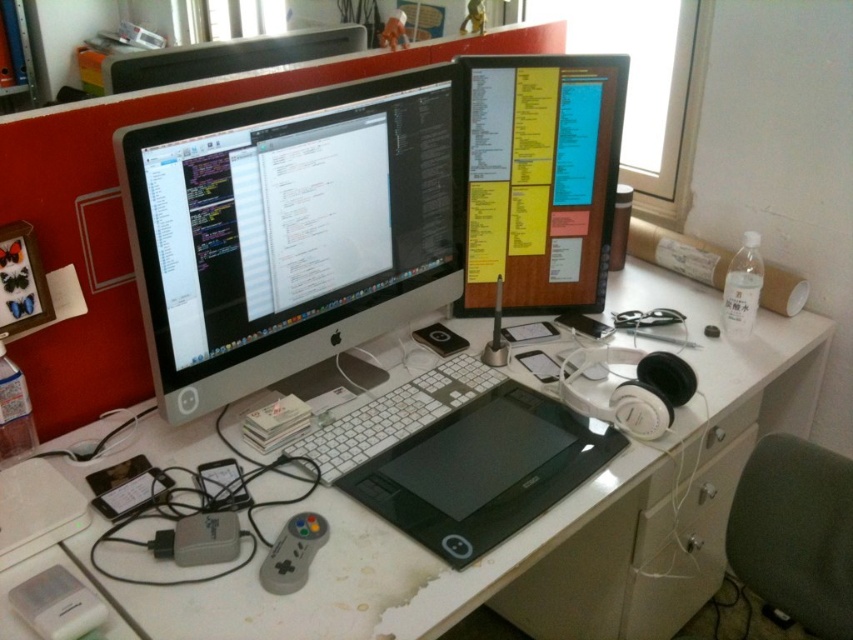
Question: Among these objects, which one is nearest to the camera?

Choices:
 (A) black matte drawing tablet at center
 (B) sleek silver monitor at center
 (C) white plastic computer desk at center
 (D) white matte keyboard at center

Answer: (C)

Question: Is white plastic computer desk at center to the right of woodenobject at upper center from the viewer's perspective?

Choices:
 (A) no
 (B) yes

Answer: (A)

Question: Does sleek silver monitor at center have a larger size compared to black matte drawing tablet at center?

Choices:
 (A) no
 (B) yes

Answer: (B)

Question: Among these objects, which one is farthest from the camera?

Choices:
 (A) black matte drawing tablet at center
 (B) white plastic computer desk at center
 (C) matte black monitor at upper center

Answer: (C)

Question: Observing the image, what is the correct spatial positioning of sleek silver monitor at center in reference to white matte keyboard at center?

Choices:
 (A) below
 (B) above

Answer: (B)

Question: Which of the following is the farthest from the observer?

Choices:
 (A) (440, 618)
 (B) (421, 531)
 (C) (376, 442)
 (D) (521, 257)

Answer: (D)